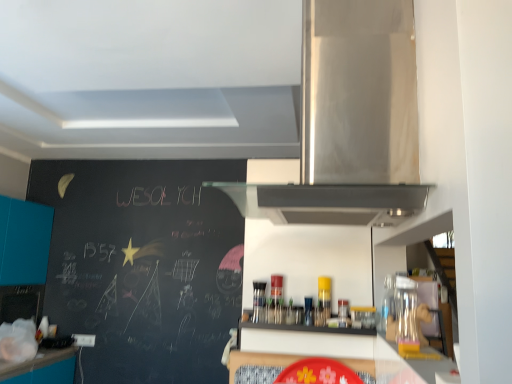
Question: Considering their positions, is stainless steel range hood at upper center located in front of or behind teal matte cabinet at left?

Choices:
 (A) front
 (B) behind

Answer: (A)

Question: Is stainless steel range hood at upper center spatially inside teal matte cabinet at left, or outside of it?

Choices:
 (A) inside
 (B) outside

Answer: (B)

Question: Estimate the real-world distances between objects in this image. Which object is closer to the stainless steel range hood at upper center?

Choices:
 (A) black matte shelf at center
 (B) teal matte cabinet at left

Answer: (A)

Question: Estimate the real-world distances between objects in this image. Which object is farther from the black matte shelf at center?

Choices:
 (A) teal matte cabinet at left
 (B) stainless steel range hood at upper center

Answer: (A)